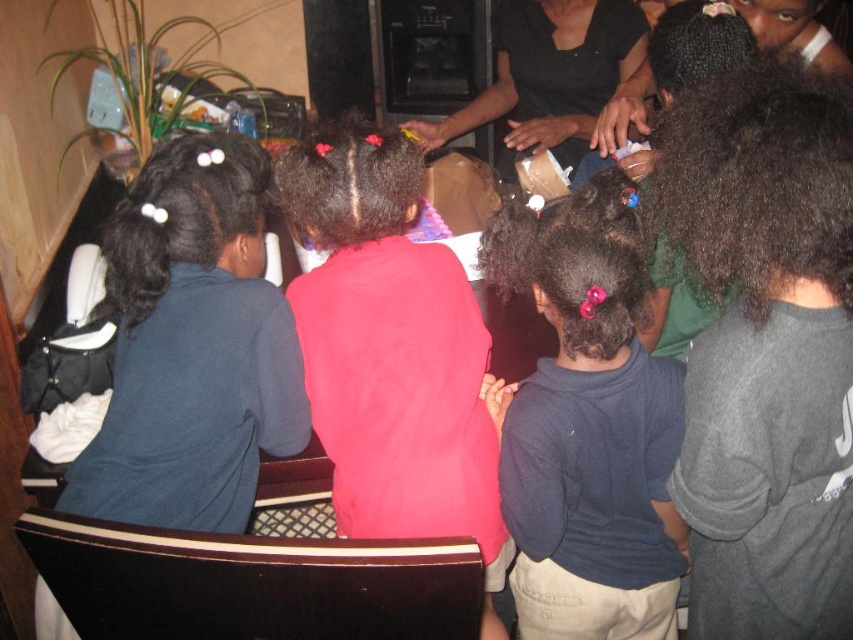
Is dark blue shirt at center positioned before black matte shirt at upper center?

Yes.

Does point (581, 244) come closer to viewer compared to point (578, 160)?

Yes, point (581, 244) is in front of point (578, 160).

In order to click on dark blue shirt at center in this screenshot , I will do `click(585, 435)`.

Is matte blue shirt at left shorter than black matte shirt at upper center?

No, matte blue shirt at left is not shorter than black matte shirt at upper center.

Does point (277, 298) lie behind point (495, 99)?

No.

This screenshot has width=853, height=640. What do you see at coordinates (192, 346) in the screenshot? I see `matte blue shirt at left` at bounding box center [192, 346].

You are a GUI agent. You are given a task and a screenshot of the screen. Output one action in this format:
    pyautogui.click(x=<x>, y=<y>)
    Task: Click on the matte blue shirt at left
    This screenshot has height=640, width=853.
    Given the screenshot: What is the action you would take?
    pyautogui.click(x=192, y=346)

What are the coordinates of `matte blue shirt at left` in the screenshot? It's located at (192, 346).

Between point (241, 204) and point (480, 369), which one is positioned behind?

Point (480, 369)

Identify the location of matte blue shirt at left. (192, 346).

Where is `matte blue shirt at left`? matte blue shirt at left is located at coordinates tap(192, 346).